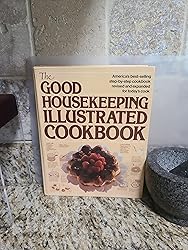
Where is `light yellow book`? light yellow book is located at coordinates (93, 80).